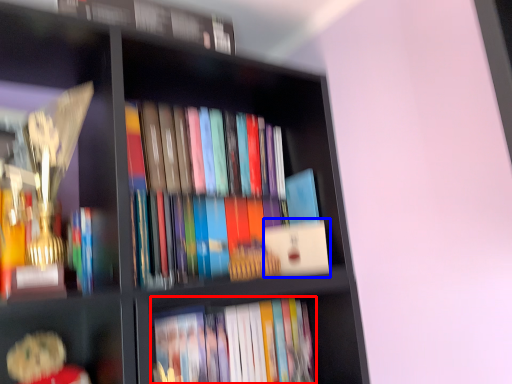
Question: Which object appears farthest to the camera in this image, book (highlighted by a red box) or paperback book (highlighted by a blue box)?

Choices:
 (A) book
 (B) paperback book

Answer: (B)